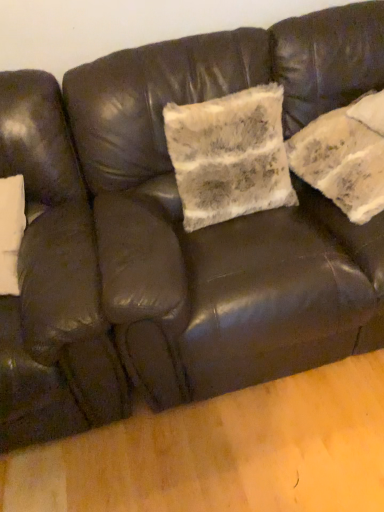
Question: Considering the relative sizes of fuzzy white pillow at center and matte black armchair at left in the image provided, is fuzzy white pillow at center thinner than matte black armchair at left?

Choices:
 (A) no
 (B) yes

Answer: (B)

Question: Is fuzzy white pillow at center outside of matte black armchair at left?

Choices:
 (A) yes
 (B) no

Answer: (A)

Question: Is matte black armchair at left at the back of fuzzy white pillow at center?

Choices:
 (A) no
 (B) yes

Answer: (A)

Question: Does fuzzy white pillow at center have a larger size compared to matte black armchair at left?

Choices:
 (A) yes
 (B) no

Answer: (B)

Question: Is fuzzy white pillow at center positioned in front of matte black armchair at left?

Choices:
 (A) no
 (B) yes

Answer: (A)

Question: Considering the relative sizes of fuzzy white pillow at center and matte black armchair at left in the image provided, is fuzzy white pillow at center wider than matte black armchair at left?

Choices:
 (A) no
 (B) yes

Answer: (A)

Question: Is matte black armchair at left to the right of fuzzy white pillow at center from the viewer's perspective?

Choices:
 (A) yes
 (B) no

Answer: (B)

Question: Can you confirm if matte black armchair at left is wider than fuzzy white pillow at center?

Choices:
 (A) no
 (B) yes

Answer: (B)

Question: Does matte black armchair at left appear on the left side of fuzzy white pillow at center?

Choices:
 (A) yes
 (B) no

Answer: (A)

Question: Is matte black armchair at left directly adjacent to fuzzy white pillow at center?

Choices:
 (A) yes
 (B) no

Answer: (B)

Question: From a real-world perspective, is matte black armchair at left located beneath fuzzy white pillow at center?

Choices:
 (A) no
 (B) yes

Answer: (B)

Question: Is fuzzy white pillow at center inside matte black armchair at left?

Choices:
 (A) no
 (B) yes

Answer: (A)

Question: From a real-world perspective, is matte black armchair at left above or below fuzzy white pillow at center?

Choices:
 (A) above
 (B) below

Answer: (B)